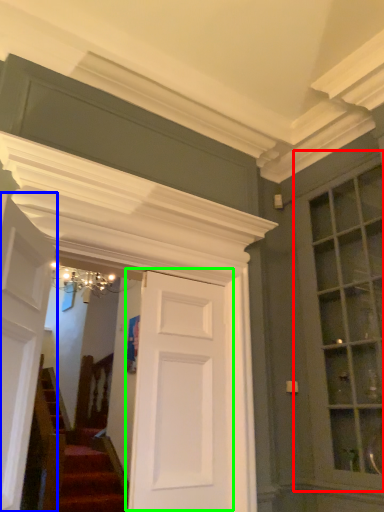
Question: Estimate the real-world distances between objects in this image. Which object is farther from window (highlighted by a red box), door (highlighted by a blue box) or door (highlighted by a green box)?

Choices:
 (A) door
 (B) door

Answer: (A)